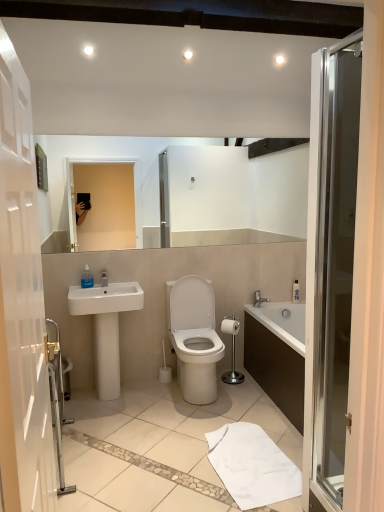
Where is `white glossy toilet at center`? The width and height of the screenshot is (384, 512). white glossy toilet at center is located at coordinates (194, 337).

Measure the distance between point [86,278] and camera.

10.90 feet.

What is the approximate width of translucent plastic soap dispenser at sink, which appears as the 2th toiletry when ordered from the bottom?

It is 3.47 inches.

The height and width of the screenshot is (512, 384). What do you see at coordinates (252, 465) in the screenshot?
I see `white cotton bath towel at lower center` at bounding box center [252, 465].

In order to face white matte toilet paper at center, should I rotate leftwards or rightwards?

Rotate your view right by about 5.232°.

The width and height of the screenshot is (384, 512). Describe the element at coordinates (230, 326) in the screenshot. I see `white matte toilet paper at center` at that location.

Identify the location of white glossy toilet at center. The height and width of the screenshot is (512, 384). (194, 337).

Considering the points (255, 293) and (273, 484), which point is in front, point (255, 293) or point (273, 484)?

Point (273, 484)

Can white cotton bath towel at lower center be found inside silver metallic faucet at lower right?

No, white cotton bath towel at lower center is not inside silver metallic faucet at lower right.

From a real-world perspective, is silver metallic faucet at lower right beneath white cotton bath towel at lower center?

No.

Can you confirm if silver metallic faucet at lower right is thinner than white cotton bath towel at lower center?

Indeed, silver metallic faucet at lower right has a lesser width compared to white cotton bath towel at lower center.

From the image's perspective, which is below, polished chrome toilet paper holder at center or silver metallic faucet at lower right?

polished chrome toilet paper holder at center appears lower in the image.

Considering the positions of objects polished chrome toilet paper holder at center and silver metallic faucet at lower right in the image provided, who is more to the left, polished chrome toilet paper holder at center or silver metallic faucet at lower right?

Positioned to the left is polished chrome toilet paper holder at center.

From a real-world perspective, is polished chrome toilet paper holder at center on top of silver metallic faucet at lower right?

No, from a real-world perspective, polished chrome toilet paper holder at center is not over silver metallic faucet at lower right

Is point (230, 378) positioned behind point (256, 305)?

That is False.

Based on their sizes in the image, would you say white cotton bath towel at lower center is bigger or smaller than transparent glass door at right?

In the image, white cotton bath towel at lower center appears to be smaller than transparent glass door at right.

Would you consider white cotton bath towel at lower center to be distant from transparent glass door at right?

That's not correct — white cotton bath towel at lower center is a little close to transparent glass door at right.

Can you tell me how much white cotton bath towel at lower center and transparent glass door at right differ in facing direction?

The facing directions of white cotton bath towel at lower center and transparent glass door at right are 0.00962 degrees apart.

From a real-world perspective, which is physically above, white cotton bath towel at lower center or transparent glass door at right?

transparent glass door at right, from a real-world perspective.

Considering the positions of objects translucent plastic soap dispenser at sink, which is the 1th toiletry from left to right, and transparent glass door at right in the image provided, who is more to the right, translucent plastic soap dispenser at sink, which is the 1th toiletry from left to right, or transparent glass door at right?

From the viewer's perspective, transparent glass door at right appears more on the right side.

In the scene shown: From the image's perspective, between translucent plastic soap dispenser at sink, which appears as the first toiletry when viewed from the front, and transparent glass door at right, which one is located above?

translucent plastic soap dispenser at sink, which appears as the first toiletry when viewed from the front, appears higher in the image.

Based on the photo, is translucent plastic soap dispenser at sink, which appears as the 2th toiletry when ordered from the bottom, looking in the opposite direction of transparent glass door at right?

No, translucent plastic soap dispenser at sink, which appears as the 2th toiletry when ordered from the bottom, is not facing the opposite direction of transparent glass door at right.

Does point (85, 272) appear closer or farther from the camera than point (350, 263)?

Point (85, 272).

From the image's perspective, which object appears higher, white plastic bottle at upper right, acting as the first toiletry starting from the back, or white glossy toilet at center?

white plastic bottle at upper right, acting as the first toiletry starting from the back, from the image's perspective.

Which is farther from the camera, (x=297, y=290) or (x=209, y=342)?

Positioned behind is point (x=297, y=290).

Is white plastic bottle at upper right, the 1th toiletry in the bottom-to-top sequence, closer to camera compared to white glossy toilet at center?

That is False.

Is white plastic bottle at upper right, marked as the 2th toiletry in a left-to-right arrangement, situated inside white glossy toilet at center or outside?

The correct answer is: outside.

Can you see white plastic bottle at upper right, the second toiletry in the top-to-bottom sequence, touching polished chrome toilet paper holder at center?

white plastic bottle at upper right, the second toiletry in the top-to-bottom sequence, is not next to polished chrome toilet paper holder at center, and they're not touching.

Which object is further away from the camera, white plastic bottle at upper right, marked as the 2th toiletry in a front-to-back arrangement, or polished chrome toilet paper holder at center?

white plastic bottle at upper right, marked as the 2th toiletry in a front-to-back arrangement, is further from the camera.

Is white plastic bottle at upper right, acting as the first toiletry starting from the back, wider than white matte toilet paper at center?

No, white plastic bottle at upper right, acting as the first toiletry starting from the back, is not wider than white matte toilet paper at center.

Is white plastic bottle at upper right, the 1th toiletry in the bottom-to-top sequence, looking in the opposite direction of white matte toilet paper at center?

That's not correct — white plastic bottle at upper right, the 1th toiletry in the bottom-to-top sequence, is not looking away from white matte toilet paper at center.

Is white plastic bottle at upper right, the second toiletry in the top-to-bottom sequence, closer to the viewer compared to white matte toilet paper at center?

No, it is behind white matte toilet paper at center.

From a real-world perspective, is white plastic bottle at upper right, marked as the 2th toiletry in a left-to-right arrangement, on white matte toilet paper at center?

Yes, from a real-world perspective, white plastic bottle at upper right, marked as the 2th toiletry in a left-to-right arrangement, is on top of white matte toilet paper at center.

You are a GUI agent. You are given a task and a screenshot of the screen. Output one action in this format:
    pyautogui.click(x=<x>, y=<y>)
    Task: Click on the bath towel that is below the silver metallic faucet at lower right (from the image's perspective)
    The height and width of the screenshot is (512, 384).
    Given the screenshot: What is the action you would take?
    pyautogui.click(x=252, y=465)

This screenshot has width=384, height=512. In order to click on tap located on the right of polished chrome toilet paper holder at center in this screenshot , I will do `click(259, 298)`.

Looking at this image, from the image, which object appears to be nearer to translucent plastic soap dispenser at sink, the 2th toiletry in the back-to-front sequence, silver metallic faucet at lower right or white glossy sink at lower left?

white glossy sink at lower left lies closer to translucent plastic soap dispenser at sink, the 2th toiletry in the back-to-front sequence, than the other object.

In the scene shown: From the image, which object appears to be farther from white matte toilet paper at center, white glossy toilet at center or white plastic bottle at upper right, which is counted as the first toiletry, starting from the right?

white plastic bottle at upper right, which is counted as the first toiletry, starting from the right, lies further to white matte toilet paper at center than the other object.

Considering their positions, is polished chrome toilet paper holder at center positioned closer to translucent plastic soap dispenser at sink, which appears as the 2th toiletry when ordered from the bottom, than silver metallic faucet at lower right?

polished chrome toilet paper holder at center.

Considering their positions, is white cotton bath towel at lower center positioned closer to white plastic bottle at upper right, which is counted as the first toiletry, starting from the right, than polished chrome toilet paper holder at center?

Based on the image, polished chrome toilet paper holder at center appears to be nearer to white plastic bottle at upper right, which is counted as the first toiletry, starting from the right.

Considering their positions, is white plastic bottle at upper right, marked as the 2th toiletry in a front-to-back arrangement, positioned closer to polished chrome toilet paper holder at center than silver metallic faucet at lower right?

silver metallic faucet at lower right is positioned closer to the anchor polished chrome toilet paper holder at center.

Based on the photo, from the image, which object appears to be farther from transparent glass door at right, white glossy toilet at center or silver metallic faucet at lower right?

silver metallic faucet at lower right lies further to transparent glass door at right than the other object.

Looking at the image, which one is located further to white glossy sink at lower left, silver metallic faucet at lower right or white matte toilet paper at center?

silver metallic faucet at lower right.

Based on their spatial positions, is transparent glass door at right or white matte toilet paper at center closer to polished chrome toilet paper holder at center?

Based on the image, white matte toilet paper at center appears to be nearer to polished chrome toilet paper holder at center.

Where is `sink situated between translucent plastic soap dispenser at sink, the 2th toiletry in the back-to-front sequence, and white matte toilet paper at center from left to right`? sink situated between translucent plastic soap dispenser at sink, the 2th toiletry in the back-to-front sequence, and white matte toilet paper at center from left to right is located at coordinates (106, 327).

Find the location of a particular element. Image resolution: width=384 pixels, height=512 pixels. toilet between translucent plastic soap dispenser at sink, which is the 1th toiletry from left to right, and white cotton bath towel at lower center from left to right is located at coordinates (194, 337).

Locate an element on the screen. bath towel positioned between transparent glass door at right and white glossy sink at lower left from near to far is located at coordinates click(x=252, y=465).

Where is `sink between white cotton bath towel at lower center and white matte toilet paper at center from front to back`? The height and width of the screenshot is (512, 384). sink between white cotton bath towel at lower center and white matte toilet paper at center from front to back is located at coordinates (106, 327).